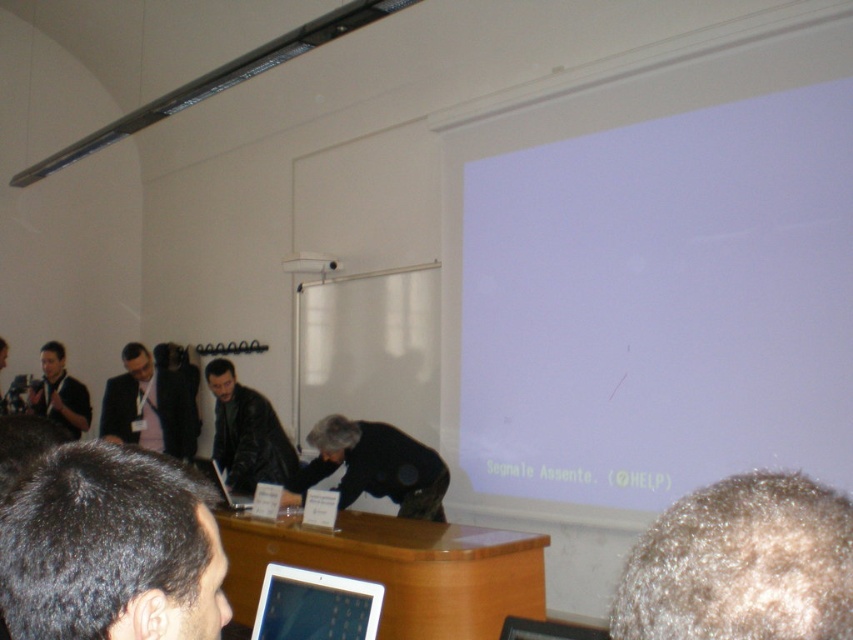
Between point (143, 461) and point (329, 268), which one is positioned in front?

Point (143, 461) is in front.

Who is lower down, dark brown hair at lower left or white plastic projector at upper center?

dark brown hair at lower left is below.

Is point (48, 497) closer to viewer compared to point (337, 262)?

Yes, it is in front of point (337, 262).

Where is `dark brown hair at lower left`? This screenshot has width=853, height=640. dark brown hair at lower left is located at coordinates (109, 548).

Who is more distant from viewer, (202, 596) or (305, 636)?

Positioned behind is point (305, 636).

Is point (86, 602) positioned behind point (293, 636)?

No, it is in front of (293, 636).

Identify the location of dark brown hair at lower left. (109, 548).

Does dark brown hair at lower left appear on the left side of dark suit at left?

In fact, dark brown hair at lower left is to the right of dark suit at left.

Which is in front, point (186, 522) or point (144, 445)?

Positioned in front is point (186, 522).

Where is `dark brown hair at lower left`? The height and width of the screenshot is (640, 853). dark brown hair at lower left is located at coordinates (109, 548).